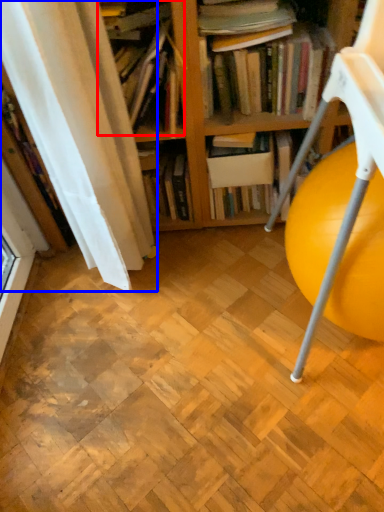
Question: Which object appears farthest to the camera in this image, book (highlighted by a red box) or curtain (highlighted by a blue box)?

Choices:
 (A) book
 (B) curtain

Answer: (A)